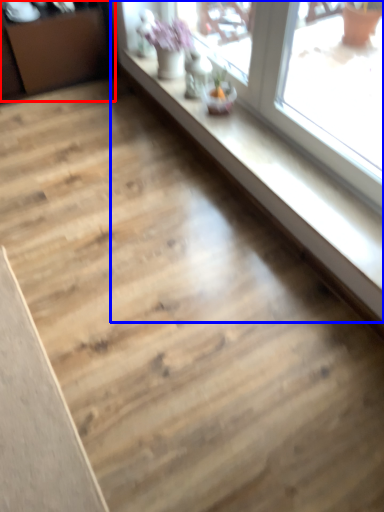
Question: Which of the following is the closest to the observer, dresser (highlighted by a red box) or window (highlighted by a blue box)?

Choices:
 (A) dresser
 (B) window

Answer: (B)